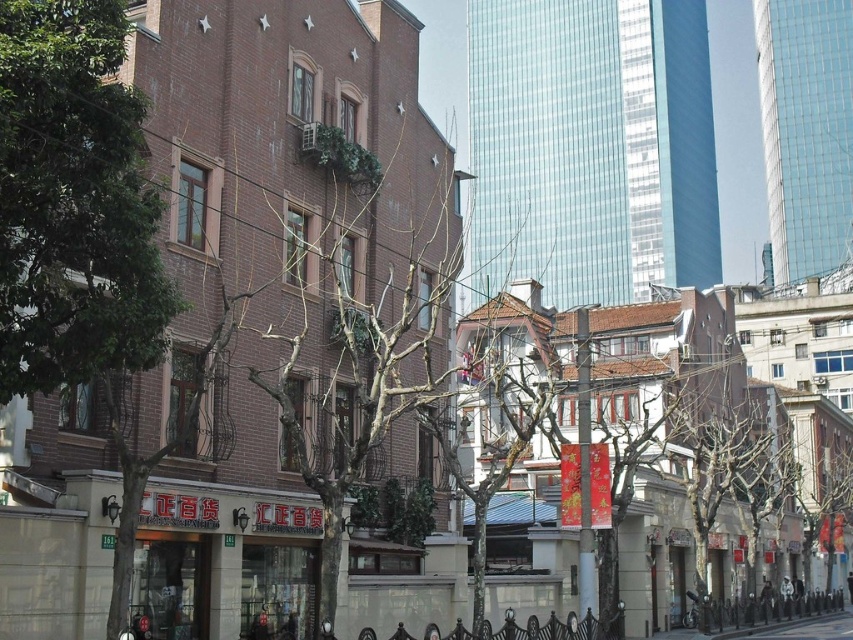
Who is more distant from viewer, [62,364] or [726,636]?

Positioned behind is point [726,636].

Who is higher up, green leafy tree at upper left or gray concrete pavement at lower center?

green leafy tree at upper left is higher up.

Locate an element on the screen. The image size is (853, 640). green leafy tree at upper left is located at coordinates (74, 202).

The width and height of the screenshot is (853, 640). In order to click on green leafy tree at upper left in this screenshot , I will do `click(74, 202)`.